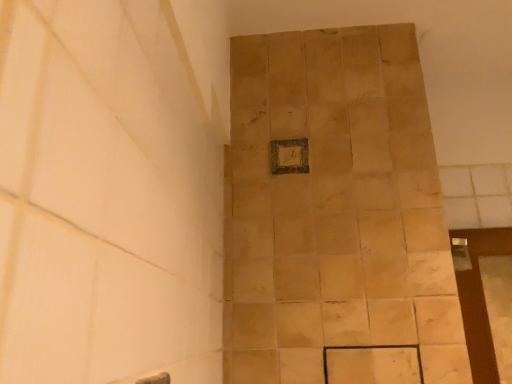
Locate an element on the screen. matte stone plaque at center is located at coordinates (289, 156).

The image size is (512, 384). What do you see at coordinates (289, 156) in the screenshot?
I see `matte stone plaque at center` at bounding box center [289, 156].

The image size is (512, 384). Identify the location of matte stone plaque at center. (289, 156).